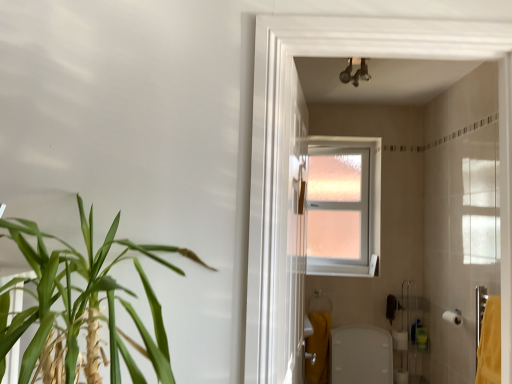
Question: From a real-world perspective, is green leafy plant at left physically below metallic chrome light fixture at upper center?

Choices:
 (A) no
 (B) yes

Answer: (B)

Question: Is green leafy plant at left placed right next to metallic chrome light fixture at upper center?

Choices:
 (A) yes
 (B) no

Answer: (B)

Question: Can you confirm if green leafy plant at left is positioned to the right of metallic chrome light fixture at upper center?

Choices:
 (A) yes
 (B) no

Answer: (B)

Question: Considering the relative sizes of green leafy plant at left and metallic chrome light fixture at upper center in the image provided, is green leafy plant at left smaller than metallic chrome light fixture at upper center?

Choices:
 (A) yes
 (B) no

Answer: (B)

Question: Can you confirm if green leafy plant at left is bigger than metallic chrome light fixture at upper center?

Choices:
 (A) no
 (B) yes

Answer: (B)

Question: Relative to yellow fabric bath towel at lower right, positioned as the 2th bath towel in right-to-left order, is white matte toilet paper at lower right, placed as the 1th toilet paper when sorted from right to left, in front or behind?

Choices:
 (A) front
 (B) behind

Answer: (A)

Question: Considering the positions of white matte toilet paper at lower right, which is the 2th toilet paper in left-to-right order, and yellow fabric bath towel at lower right, which is counted as the first bath towel, starting from the left, in the image, is white matte toilet paper at lower right, which is the 2th toilet paper in left-to-right order, taller or shorter than yellow fabric bath towel at lower right, which is counted as the first bath towel, starting from the left,?

Choices:
 (A) tall
 (B) short

Answer: (B)

Question: From a real-world perspective, is white matte toilet paper at lower right, placed as the 1th toilet paper when sorted from right to left, above or below yellow fabric bath towel at lower right, positioned as the 2th bath towel in right-to-left order?

Choices:
 (A) below
 (B) above

Answer: (B)

Question: Looking at the image, does white matte toilet paper at lower right, placed as the second toilet paper when sorted from bottom to top, seem bigger or smaller compared to yellow fabric bath towel at lower right, which is counted as the second bath towel, starting from the top?

Choices:
 (A) big
 (B) small

Answer: (B)

Question: Relative to metallic chrome light fixture at upper center, is white matte toilet paper at lower right, arranged as the second toilet paper when viewed from the top, in front or behind?

Choices:
 (A) behind
 (B) front

Answer: (A)

Question: Is point (401, 342) closer or farther from the camera than point (355, 86)?

Choices:
 (A) farther
 (B) closer

Answer: (A)

Question: From a real-world perspective, relative to metallic chrome light fixture at upper center, is white matte toilet paper at lower right, which is counted as the first toilet paper, starting from the back, vertically above or below?

Choices:
 (A) above
 (B) below

Answer: (B)

Question: Based on their positions, is white matte toilet paper at lower right, which is counted as the first toilet paper, starting from the back, located to the left or right of metallic chrome light fixture at upper center?

Choices:
 (A) left
 (B) right

Answer: (B)

Question: Does point (317, 185) appear closer or farther from the camera than point (454, 316)?

Choices:
 (A) closer
 (B) farther

Answer: (B)

Question: From a real-world perspective, relative to white matte toilet paper at lower right, which is the 2th toilet paper in left-to-right order, is clear glass window at upper center vertically above or below?

Choices:
 (A) below
 (B) above

Answer: (B)